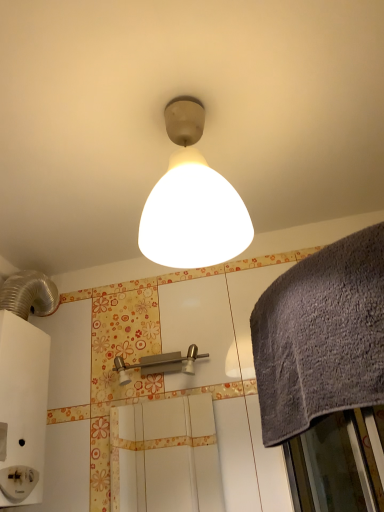
Question: Is brushed metal shower at center far away from gray textured towel at right?

Choices:
 (A) yes
 (B) no

Answer: (B)

Question: Does brushed metal shower at center appear on the left side of gray textured towel at right?

Choices:
 (A) no
 (B) yes

Answer: (B)

Question: Considering the relative sizes of brushed metal shower at center and gray textured towel at right in the image provided, is brushed metal shower at center taller than gray textured towel at right?

Choices:
 (A) yes
 (B) no

Answer: (B)

Question: Considering the relative sizes of brushed metal shower at center and gray textured towel at right in the image provided, is brushed metal shower at center thinner than gray textured towel at right?

Choices:
 (A) no
 (B) yes

Answer: (B)

Question: Is brushed metal shower at center in front of gray textured towel at right?

Choices:
 (A) yes
 (B) no

Answer: (B)

Question: Is the position of brushed metal shower at center more distant than that of gray textured towel at right?

Choices:
 (A) yes
 (B) no

Answer: (A)

Question: Is gray textured towel at right not inside white matte screen door at center?

Choices:
 (A) no
 (B) yes

Answer: (B)

Question: Can you confirm if gray textured towel at right is positioned to the left of white matte screen door at center?

Choices:
 (A) no
 (B) yes

Answer: (A)

Question: From the image's perspective, would you say gray textured towel at right is shown under white matte screen door at center?

Choices:
 (A) no
 (B) yes

Answer: (A)

Question: Can you confirm if gray textured towel at right is bigger than white matte screen door at center?

Choices:
 (A) no
 (B) yes

Answer: (B)

Question: Is gray textured towel at right with white matte screen door at center?

Choices:
 (A) no
 (B) yes

Answer: (A)

Question: Is gray textured towel at right positioned with its back to white matte screen door at center?

Choices:
 (A) yes
 (B) no

Answer: (B)

Question: Does white matte screen door at center appear on the right side of matte white lampshade at center?

Choices:
 (A) no
 (B) yes

Answer: (A)